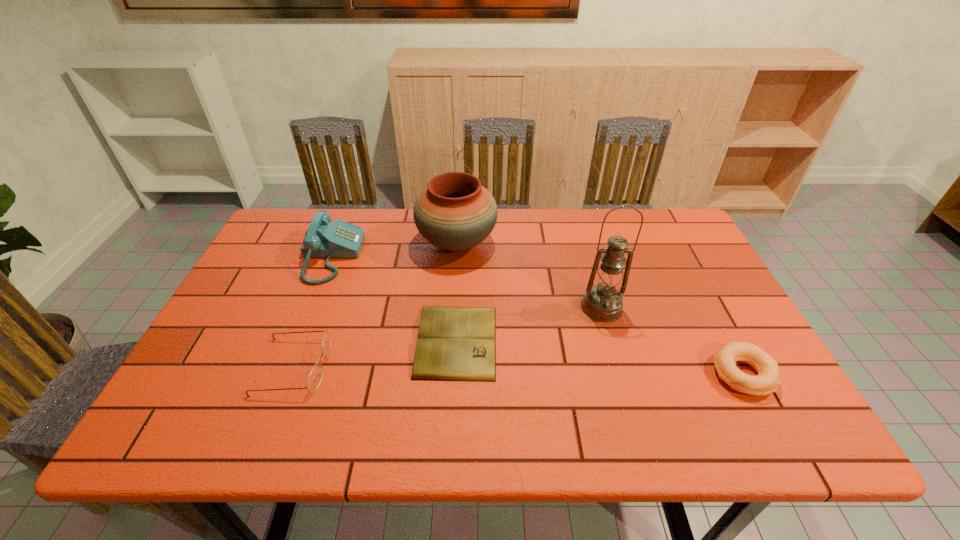
You are a GUI agent. You are given a task and a screenshot of the screen. Output one action in this format:
    pyautogui.click(x=<x>, y=<y>)
    Task: Click on the fifth object from left to right
    Image resolution: width=960 pixels, height=540 pixels.
    Given the screenshot: What is the action you would take?
    pyautogui.click(x=603, y=302)

Where is `oil lamp`? oil lamp is located at coordinates (603, 302).

At what (x,y) coordinates should I click in order to perform the action: click on the second tallest object. Please return your answer as a coordinate pair (x, y). The image size is (960, 540). Looking at the image, I should click on coord(455,212).

The height and width of the screenshot is (540, 960). In order to click on telephone in this screenshot , I will do pyautogui.click(x=324, y=239).

The width and height of the screenshot is (960, 540). Identify the location of spectacles. point(315,377).

Locate an element on the screen. This screenshot has height=540, width=960. bagel is located at coordinates (767, 381).

The image size is (960, 540). Identify the location of the shortest object. (454, 343).

Locate an element on the screen. This screenshot has width=960, height=540. free spot located 0.200m on the right of the oil lamp is located at coordinates (699, 307).

Identify the location of vacant space positioned on the front of the pottery. The height and width of the screenshot is (540, 960). (449, 369).

Locate an element on the screen. Image resolution: width=960 pixels, height=540 pixels. blank space located 0.350m on the dial of the fourth shortest object is located at coordinates (478, 256).